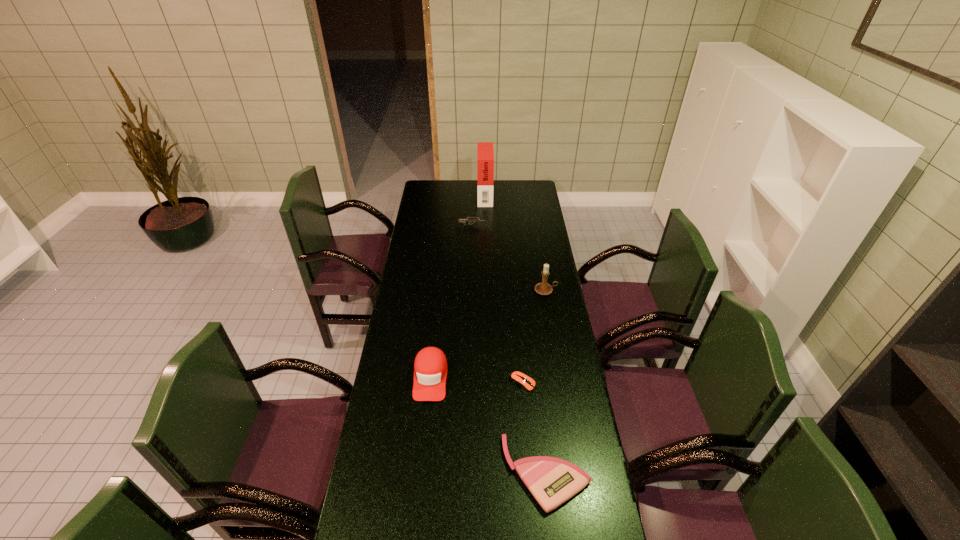
The height and width of the screenshot is (540, 960). Find the location of `cigarette case`. cigarette case is located at coordinates (485, 154).

The image size is (960, 540). I want to click on the farthest object, so click(x=485, y=154).

The image size is (960, 540). In order to click on the second tallest object in this screenshot , I will do `click(544, 288)`.

Where is `the fourth nearest object`? The image size is (960, 540). the fourth nearest object is located at coordinates (544, 288).

You are a GUI agent. You are given a task and a screenshot of the screen. Output one action in this format:
    pyautogui.click(x=<x>, y=<y>)
    Task: Click on the fourth shortest object
    This screenshot has height=540, width=960.
    Given the screenshot: What is the action you would take?
    (430, 367)

This screenshot has width=960, height=540. What are the coordinates of `the second farthest object` in the screenshot? It's located at (473, 220).

Where is `gun`? This screenshot has height=540, width=960. gun is located at coordinates (473, 220).

Locate an element on the screen. The image size is (960, 540). the nearest object is located at coordinates (552, 481).

You are a GUI agent. You are given a task and a screenshot of the screen. Output one action in this format:
    pyautogui.click(x=<x>, y=<y>)
    Task: Click on the wristlet
    This screenshot has height=540, width=960.
    Given the screenshot: What is the action you would take?
    pyautogui.click(x=552, y=481)

At what (x,y) coordinates should I click in order to perform the action: click on computer mouse. Please return your answer as a coordinate pair (x, y). This screenshot has width=960, height=540. Looking at the image, I should click on (518, 378).